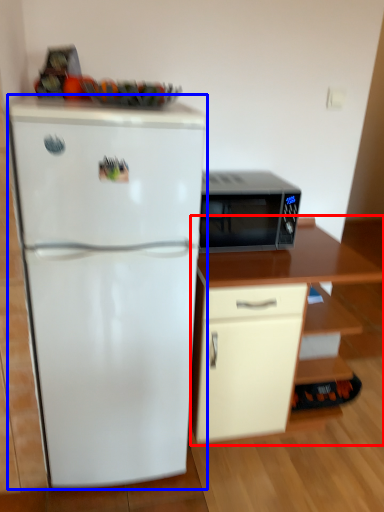
Question: Which object appears closest to the camera in this image, cabinetry (highlighted by a red box) or refrigerator (highlighted by a blue box)?

Choices:
 (A) cabinetry
 (B) refrigerator

Answer: (B)